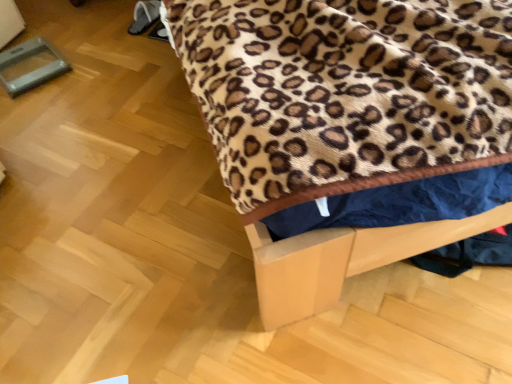
Question: Should I look upward or downward to see leopard print fabric at upper center?

Choices:
 (A) down
 (B) up

Answer: (B)